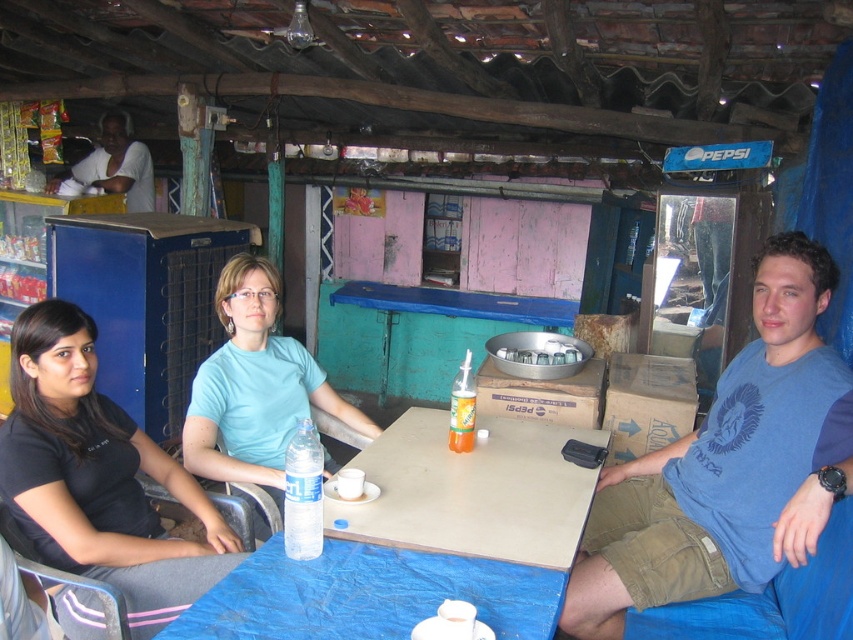
Question: Does white matte shirt at upper left come in front of clear plastic bottle at table center?

Choices:
 (A) yes
 (B) no

Answer: (B)

Question: Does black fabric shirt at center have a greater width compared to matte blue shirt at center?

Choices:
 (A) yes
 (B) no

Answer: (A)

Question: Which of the following is the farthest from the observer?

Choices:
 (A) (276, 387)
 (B) (294, 449)
 (C) (265, 620)

Answer: (A)

Question: Which point is closer to the camera?

Choices:
 (A) (846, 404)
 (B) (115, 136)
 (C) (274, 445)

Answer: (A)

Question: Which point is closer to the camera?

Choices:
 (A) matte blue shirt at center
 (B) white matte shirt at upper left

Answer: (A)

Question: Does blue cotton shirt at right appear on the right side of clear plastic bottle at center?

Choices:
 (A) yes
 (B) no

Answer: (A)